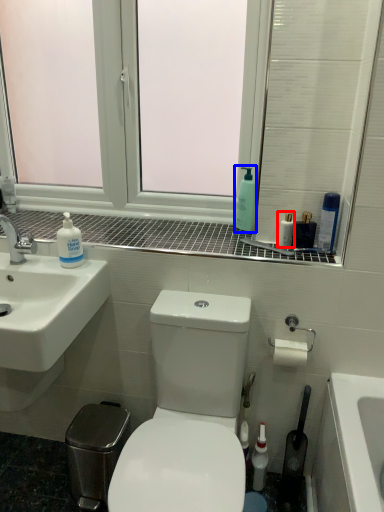
Question: Which object appears closest to the camera in this image, mouthwash (highlighted by a red box) or soap dispenser (highlighted by a blue box)?

Choices:
 (A) mouthwash
 (B) soap dispenser

Answer: (A)